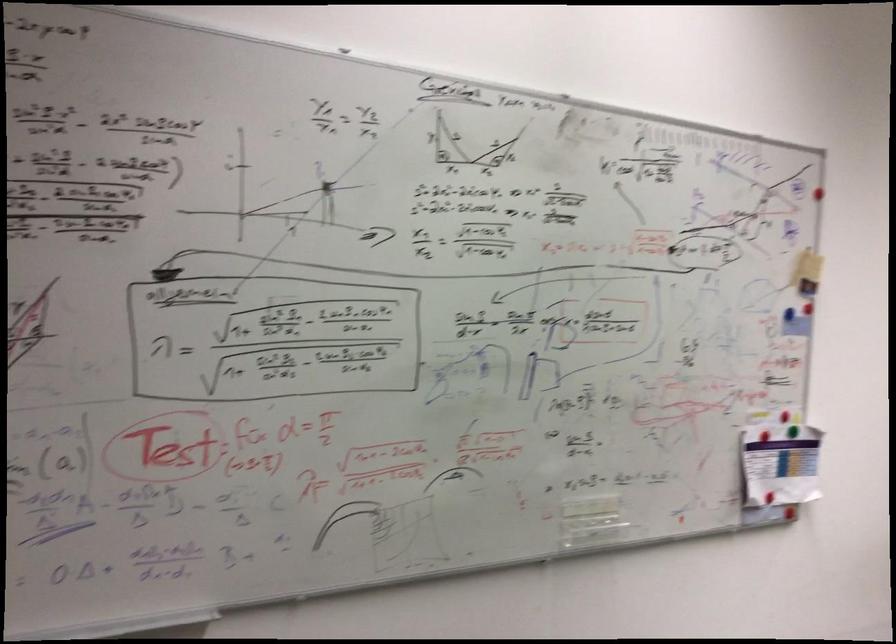
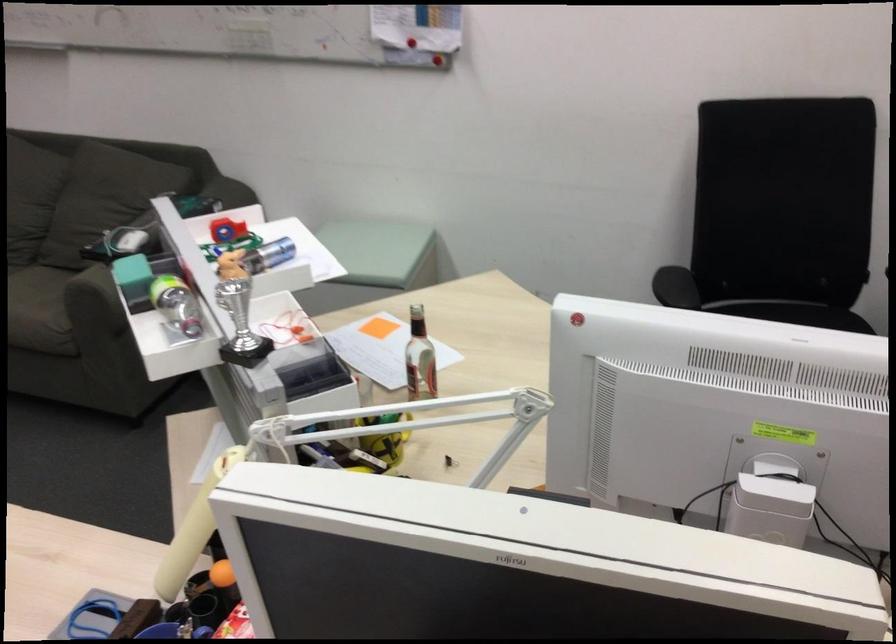
Question: I am providing you with two images of the same scene from different viewpoints. Please identify which objects are invisible in image2.

Choices:
 (A) black chair armrest
 (B) glass bottle
 (C) white power adapter
 (D) none of these

Answer: (D)